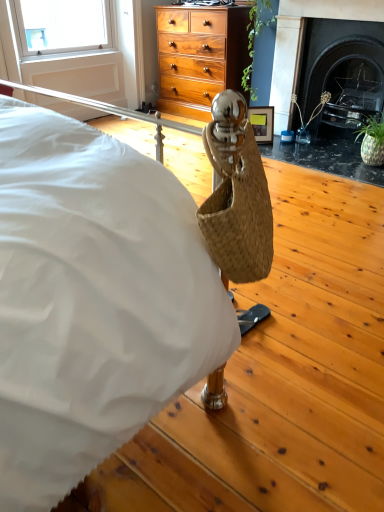
Question: Is black marble fireplace at upper right in front of wooden picture frame at center?

Choices:
 (A) no
 (B) yes

Answer: (B)

Question: Does black marble fireplace at upper right have a greater width compared to wooden picture frame at center?

Choices:
 (A) no
 (B) yes

Answer: (B)

Question: Is wooden picture frame at center a part of black marble fireplace at upper right?

Choices:
 (A) no
 (B) yes

Answer: (A)

Question: Can you confirm if black marble fireplace at upper right is thinner than wooden picture frame at center?

Choices:
 (A) no
 (B) yes

Answer: (A)

Question: Is wooden picture frame at center at the back of black marble fireplace at upper right?

Choices:
 (A) no
 (B) yes

Answer: (A)

Question: Is point (316, 115) positioned closer to the camera than point (254, 77)?

Choices:
 (A) closer
 (B) farther

Answer: (A)

Question: Considering the positions of clear glass vase at right, placed as the second plant when sorted from top to bottom, and green leafy plant at upper center, the second plant positioned from the right, in the image, is clear glass vase at right, placed as the second plant when sorted from top to bottom, taller or shorter than green leafy plant at upper center, the second plant positioned from the right,?

Choices:
 (A) short
 (B) tall

Answer: (A)

Question: Looking at their shapes, would you say clear glass vase at right, positioned as the second plant in left-to-right order, is wider or thinner than green leafy plant at upper center, the first plant from the left?

Choices:
 (A) thin
 (B) wide

Answer: (A)

Question: Do you think clear glass vase at right, placed as the second plant when sorted from top to bottom, is within green leafy plant at upper center, the first plant in the top-to-bottom sequence, or outside of it?

Choices:
 (A) outside
 (B) inside

Answer: (A)

Question: Would you say black marble fireplace at upper right is inside or outside green leafy plant at upper center, the first plant from the left?

Choices:
 (A) inside
 (B) outside

Answer: (B)

Question: Based on their positions, is black marble fireplace at upper right located to the left or right of green leafy plant at upper center, the second plant positioned from the right?

Choices:
 (A) right
 (B) left

Answer: (A)

Question: Is black marble fireplace at upper right bigger or smaller than green leafy plant at upper center, the second plant positioned from the right?

Choices:
 (A) big
 (B) small

Answer: (A)

Question: From a real-world perspective, is black marble fireplace at upper right positioned above or below green leafy plant at upper center, the second plant positioned from the right?

Choices:
 (A) below
 (B) above

Answer: (A)

Question: Is point (375, 62) closer or farther from the camera than point (268, 119)?

Choices:
 (A) farther
 (B) closer

Answer: (B)

Question: Looking at their shapes, would you say black marble fireplace at upper right is wider or thinner than wooden picture frame at center?

Choices:
 (A) thin
 (B) wide

Answer: (B)